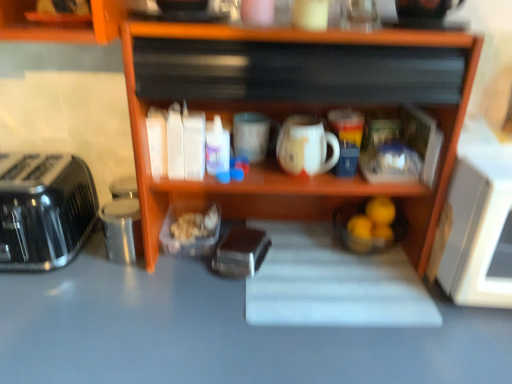
What are the coordinates of `free space in front of satin black toaster at left` in the screenshot? It's located at (39, 316).